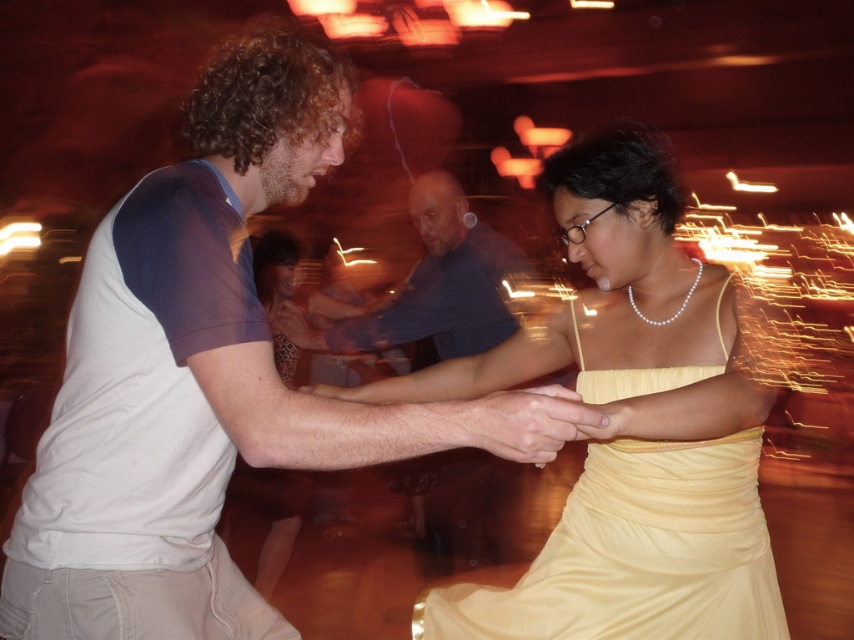
You are a photographer trying to capture a closeup of the white cotton shirt at center and the smooth skin hand at center in the image. The camera lens has a maximum focus area width of 15 cm. Can both objects fit within the focus area?

The white cotton shirt at center is wider than the smooth skin hand at center. Since the total width of both objects combined may exceed the 15 cm focus area, it depends on their exact positions. However, the description only states the shirt is wider, not their combined width. Without specific measurements, we cannot confirm if they fit together.

You are standing at the center of the room and want to move towards both point A at point (171, 257) and point B at point (489, 417). Which point should you head to first if you want to reach the one that is closer to you?

Point A at point (171, 257) is closer to you than point B at point (489, 417) because it is in front of it.

You are planning to place a small table between the yellow satin dress at center and the blue cotton shirt at center. Given that the table requires 3 feet of space, will there be enough room?

The yellow satin dress at center and blue cotton shirt at center are 3.68 feet apart, so yes, there is enough space to place the small table between them since 3.68 feet is greater than the required 3 feet.